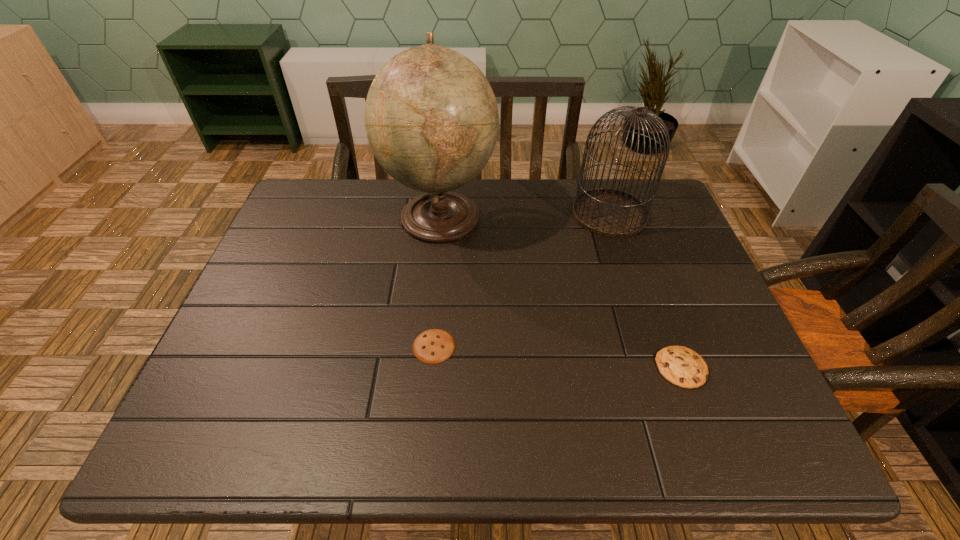
Image resolution: width=960 pixels, height=540 pixels. I want to click on vacant area that satisfies the following two spatial constraints: 1. on the front side of the second tallest object; 2. on the front-facing side of the tallest object, so click(x=610, y=216).

You are a GUI agent. You are given a task and a screenshot of the screen. Output one action in this format:
    pyautogui.click(x=<x>, y=<y>)
    Task: Click on the vacant space that satisfies the following two spatial constraints: 1. on the front-facing side of the right cookie; 2. on the left side of the tallest object
    
    Given the screenshot: What is the action you would take?
    pyautogui.click(x=426, y=368)